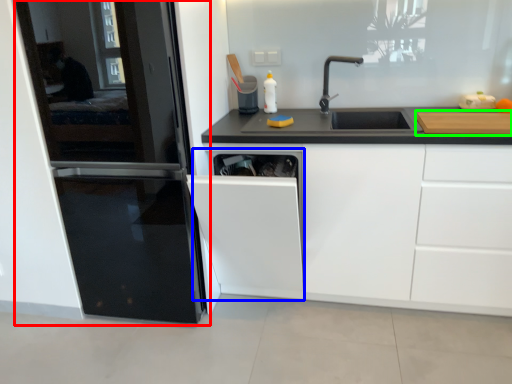
Question: Which object is positioned farthest from home appliance (highlighted by a red box)? Select from dish washer (highlighted by a blue box) and cutting board (highlighted by a green box).

Choices:
 (A) dish washer
 (B) cutting board

Answer: (B)